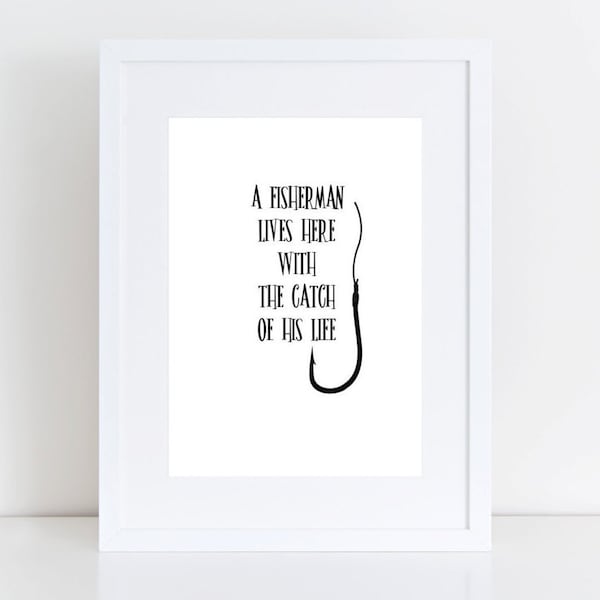
Where is `paper on which art is drawn`? This screenshot has width=600, height=600. paper on which art is drawn is located at coordinates (217, 163).